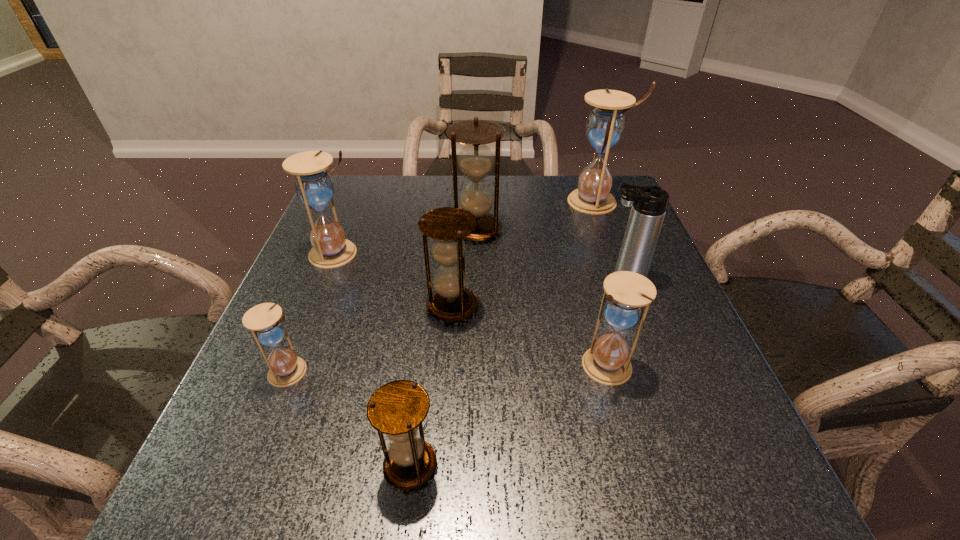
The image size is (960, 540). Find the location of `free location that satisfies the following two spatial constraints: 1. on the back side of the nearest hourglass; 2. on the left side of the biggest brown hourglass`. free location that satisfies the following two spatial constraints: 1. on the back side of the nearest hourglass; 2. on the left side of the biggest brown hourglass is located at coordinates (439, 230).

What are the coordinates of `free space that satisfies the following two spatial constraints: 1. on the back side of the nearest brown hourglass; 2. on the left side of the second nearest brown hourglass` in the screenshot? It's located at (430, 306).

Where is `vacant space that satisfies the following two spatial constraints: 1. on the back side of the fourth nearest hourglass; 2. on the left side of the tallest object`? This screenshot has height=540, width=960. vacant space that satisfies the following two spatial constraints: 1. on the back side of the fourth nearest hourglass; 2. on the left side of the tallest object is located at coordinates (459, 201).